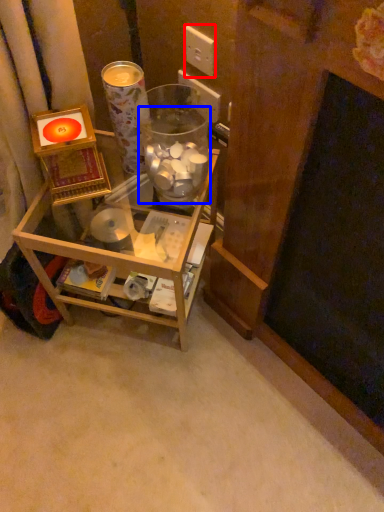
Question: Among these objects, which one is farthest to the camera, electric outlet (highlighted by a red box) or glass jar (highlighted by a blue box)?

Choices:
 (A) electric outlet
 (B) glass jar

Answer: (A)